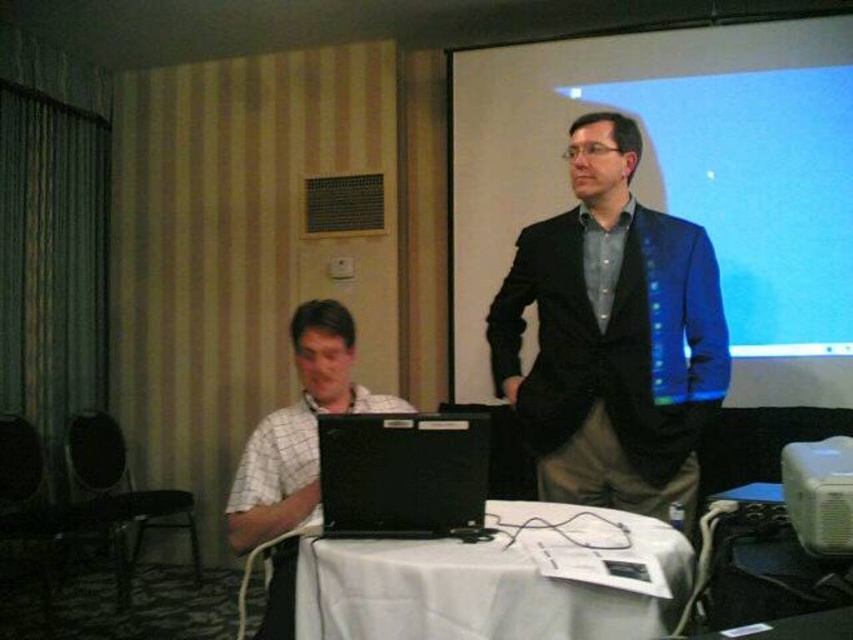
You are organizing a presentation and need to place the black matte laptop at center and the white checkered shirt at left on a table. Based on their sizes, which item should you place first to ensure proper positioning?

The black matte laptop at center is smaller than the white checkered shirt at left, so you should place the white checkered shirt at left first to accommodate its larger size before positioning the smaller laptop.

You are a photographer positioned behind the seated man in the conference room. You need to capture a clear shot of the black matte laptop at center without the white checkered shirt at left obstructing the view. Is this possible given their positions?

Yes, the black matte laptop at center is positioned above the white checkered shirt at left, so capturing a clear shot of the laptop without obstruction is feasible.